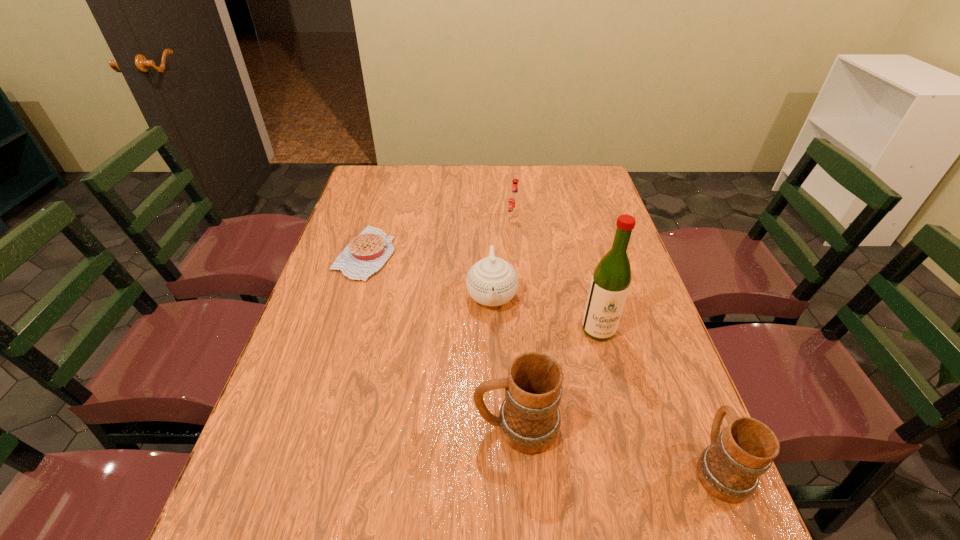
Locate an element on the screen. the taller mug is located at coordinates click(529, 419).

Identify the location of the left mug. Image resolution: width=960 pixels, height=540 pixels. (529, 419).

Where is `the right mug`? the right mug is located at coordinates (729, 469).

Find the location of `the rightmost object`. the rightmost object is located at coordinates (729, 469).

This screenshot has height=540, width=960. Find the location of `root beer`. root beer is located at coordinates (514, 200).

Locate an element on the screen. This screenshot has width=960, height=540. liquor is located at coordinates (610, 283).

Where is `the second object from right to left`? Image resolution: width=960 pixels, height=540 pixels. the second object from right to left is located at coordinates (610, 283).

This screenshot has height=540, width=960. I want to click on the leftmost object, so click(x=367, y=253).

Where is `the shortest object`? The height and width of the screenshot is (540, 960). the shortest object is located at coordinates (367, 253).

Image resolution: width=960 pixels, height=540 pixels. In order to click on chinaware in this screenshot , I will do `click(492, 281)`.